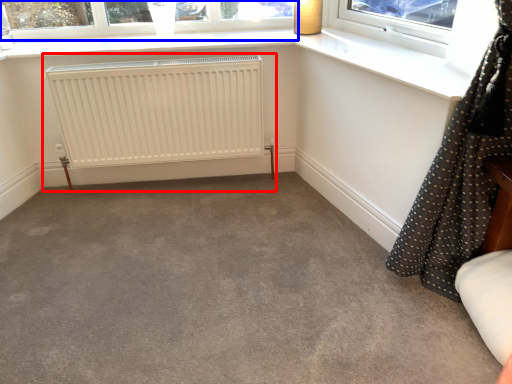
Question: Which point is further to the camera, radiator (highlighted by a red box) or window (highlighted by a blue box)?

Choices:
 (A) radiator
 (B) window

Answer: (B)